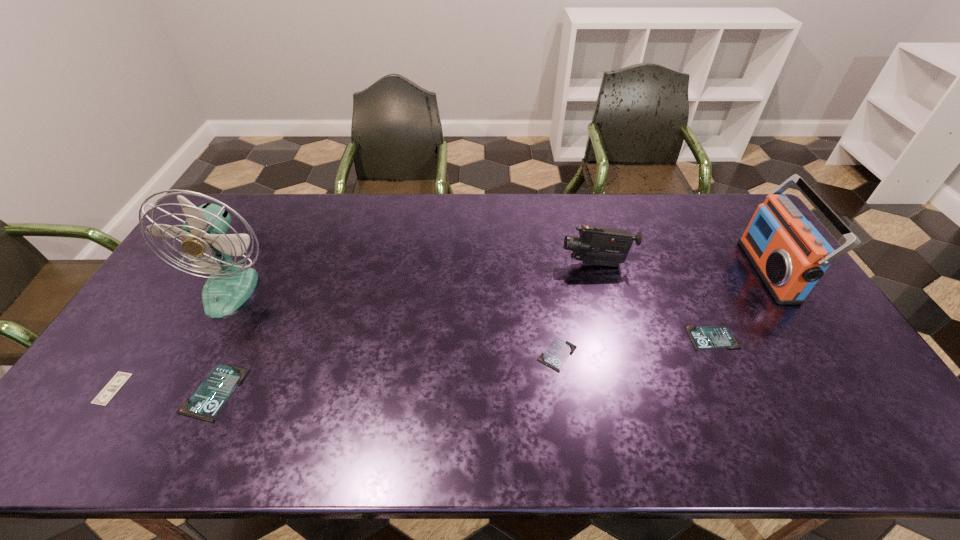
Image resolution: width=960 pixels, height=540 pixels. What are the coordinates of `vacant region that satisfies the following two spatial constraints: 1. on the back side of the second shortest object; 2. on the right side of the sixth object from left to right` in the screenshot? It's located at (555, 338).